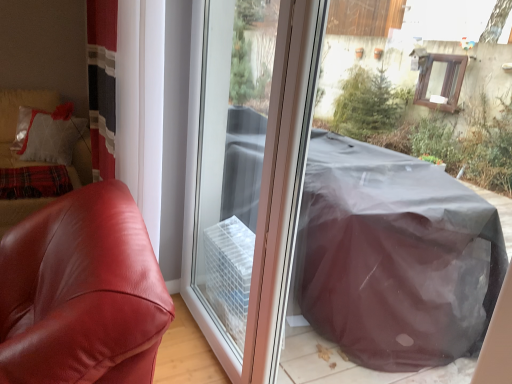
Question: In terms of width, does matte leather couch at left look wider or thinner when compared to transparent plastic screen door at center?

Choices:
 (A) thin
 (B) wide

Answer: (B)

Question: From their relative heights in the image, would you say matte leather couch at left is taller or shorter than transparent plastic screen door at center?

Choices:
 (A) tall
 (B) short

Answer: (B)

Question: Estimate the real-world distances between objects in this image. Which object is closer to the matte leather couch at left?

Choices:
 (A) transparent plastic screen door at center
 (B) satin red armchair at left

Answer: (A)

Question: Estimate the real-world distances between objects in this image. Which object is closer to the matte leather couch at left?

Choices:
 (A) transparent plastic screen door at center
 (B) satin red armchair at left

Answer: (A)